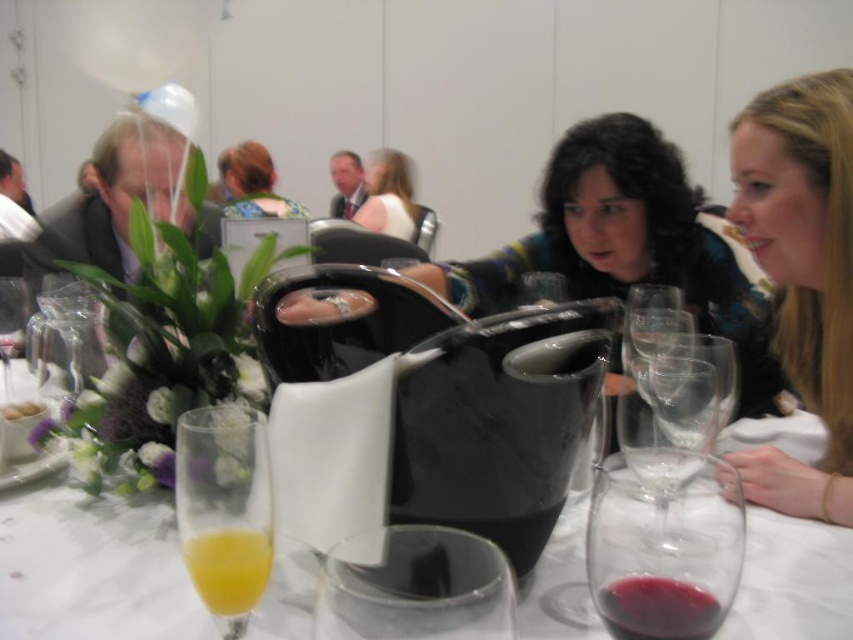
Who is more forward, (653, 390) or (248, 588)?

Positioned in front is point (248, 588).

Describe the element at coordinates (672, 401) in the screenshot. I see `clear glass wine glass at center` at that location.

Find the location of a particular element. clear glass wine glass at center is located at coordinates (672, 401).

Is point (618, 595) more distant than point (48, 296)?

No, it is not.

Can you confirm if red glass wine at center is smaller than transparent plastic wine glass at left?

Yes.

Who is more distant from viewer, (610, 596) or (80, 384)?

The point (80, 384) is behind.

Find the location of a particular element. red glass wine at center is located at coordinates (657, 609).

Does translucent glass flute at lower left appear under matte white dress at center?

Indeed, translucent glass flute at lower left is positioned under matte white dress at center.

You are a GUI agent. You are given a task and a screenshot of the screen. Output one action in this format:
    pyautogui.click(x=<x>, y=<y>)
    Task: Click on the translucent glass flute at lower left
    This screenshot has height=640, width=853.
    Given the screenshot: What is the action you would take?
    tap(224, 509)

I want to click on translucent glass flute at lower left, so click(x=224, y=509).